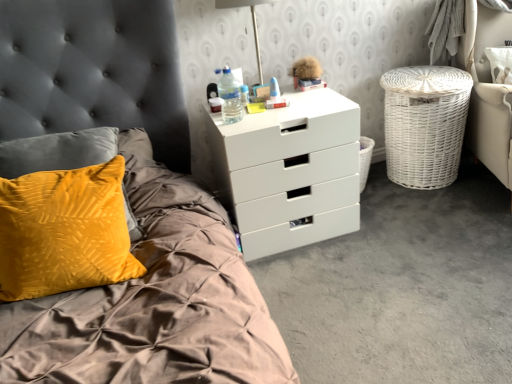
This screenshot has height=384, width=512. Identify the location of free point to the right of translucent plastic water bottle at upper right. (265, 114).